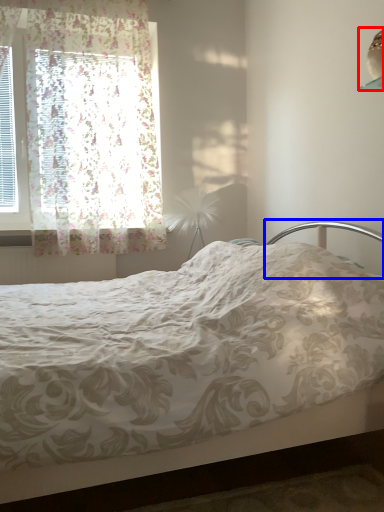
Question: Which object is closer to the camera taking this photo, lamp (highlighted by a red box) or headboard (highlighted by a blue box)?

Choices:
 (A) lamp
 (B) headboard

Answer: (B)